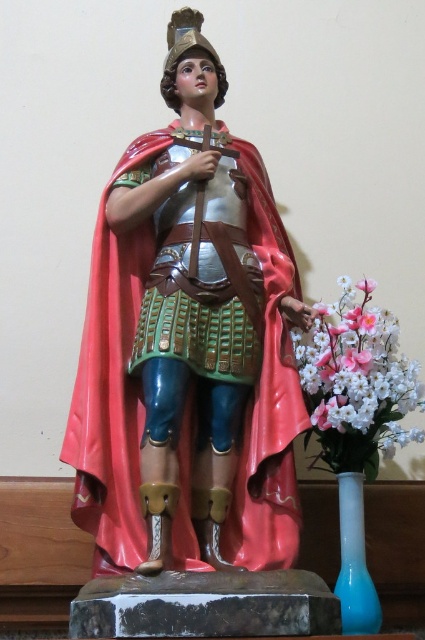
You are an interior designer arranging a space with a statue and some flowers. You need to place a new decorative item that requires more space than the current flowers. Which object between the white silk flowers at right and the blue glass vase at lower right should you consider replacing to accommodate the larger item?

The blue glass vase at lower right has a greater width than the white silk flowers at right, so replacing the blue glass vase at lower right would be better to accommodate a larger item.

You are an interior designer arranging a space with a statue of a religious figure and some decorative items. You need to ensure that the white silk flowers at right and the blue glass vase at lower right are visible from the main entrance. Considering their heights, which object might block the view of the other when placed in front?

The blue glass vase at lower right is taller than the white silk flowers at right, so placing it in front could block the view of the white silk flowers at right.

You are standing in front of the statue and want to determine which of the two points, point (215, 484) or point (356, 490), is closer to you. Based on the scene description, which point is nearer?

Point (215, 484) is closer to the viewer than point (356, 490).